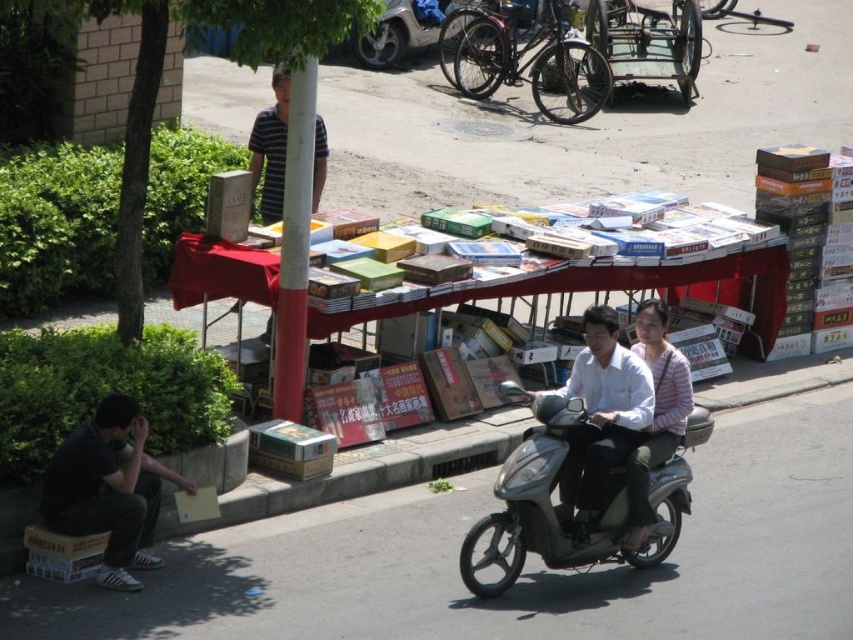
You are a pedestrian standing at the side of the road. You see the white glossy shirt at center and the metallic silver motorcycle at upper center. Which object is closer to the ground?

The white glossy shirt at center is closer to the ground as it is located below the metallic silver motorcycle at upper center.

You are standing at the center of the image and want to move towards the dark gray fabric pants at lower left. Which direction should you face to walk straight towards them?

You should face towards the lower left direction to walk straight towards the dark gray fabric pants at lower left since they are located at point (x=109, y=490) which is lower left in the image coordinate system.

You are a delivery person who needs to deliver a package to the passenger of the scooter. The passenger is wearing a striped top. You are currently standing at the point marked at coordinates (601,410). Can you directly hand over the package to the passenger without moving from your current position?

The white glossy shirt at center is located at point (601,410). Since the passenger is wearing a striped top and not the white glossy shirt, you are not standing next to them. Therefore, you cannot directly hand over the package without moving.